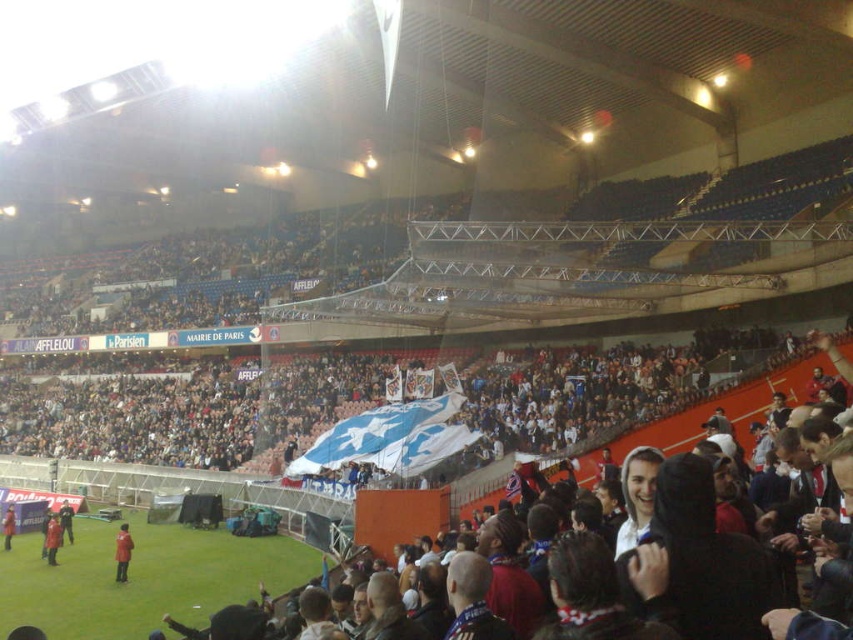
Question: Which point appears closest to the camera in this image?

Choices:
 (A) (119, 531)
 (B) (55, 552)
 (C) (10, 532)

Answer: (B)

Question: Can you confirm if red fabric jacket at lower left is bigger than red jacket at lower left?

Choices:
 (A) yes
 (B) no

Answer: (B)

Question: Is red fabric jacket at lower left in front of dark red jacket at lower left?

Choices:
 (A) no
 (B) yes

Answer: (B)

Question: Is red matte jacket at lower left below dark red jacket at lower left?

Choices:
 (A) yes
 (B) no

Answer: (A)

Question: Which is nearer to the red matte jacket at lower left?

Choices:
 (A) red fabric jacket at lower left
 (B) dark red jacket at lower left

Answer: (A)

Question: Which of the following is the farthest from the observer?

Choices:
 (A) (4, 518)
 (B) (67, 534)
 (C) (119, 570)
 (D) (49, 548)

Answer: (A)